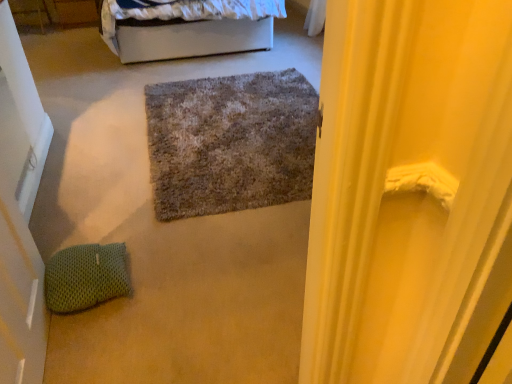
Question: Considering the relative sizes of wooden drawer at upper left and white matte door at left in the image provided, is wooden drawer at upper left shorter than white matte door at left?

Choices:
 (A) yes
 (B) no

Answer: (A)

Question: Would you say white matte door at left is part of wooden drawer at upper left's contents?

Choices:
 (A) yes
 (B) no

Answer: (B)

Question: Could you tell me if wooden drawer at upper left is facing white matte door at left?

Choices:
 (A) yes
 (B) no

Answer: (A)

Question: Considering the relative positions of wooden drawer at upper left and white matte door at left in the image provided, is wooden drawer at upper left to the right of white matte door at left from the viewer's perspective?

Choices:
 (A) no
 (B) yes

Answer: (A)

Question: From the image's perspective, is wooden drawer at upper left located beneath white matte door at left?

Choices:
 (A) no
 (B) yes

Answer: (A)

Question: Is point (163, 99) closer or farther from the camera than point (77, 306)?

Choices:
 (A) farther
 (B) closer

Answer: (A)

Question: From a real-world perspective, is textured gray rug at center above or below green knitted pillow at lower left?

Choices:
 (A) above
 (B) below

Answer: (B)

Question: Is textured gray rug at center in front of or behind green knitted pillow at lower left in the image?

Choices:
 (A) behind
 (B) front

Answer: (A)

Question: Considering the positions of textured gray rug at center and green knitted pillow at lower left in the image, is textured gray rug at center wider or thinner than green knitted pillow at lower left?

Choices:
 (A) wide
 (B) thin

Answer: (A)

Question: Based on their sizes in the image, would you say wooden drawer at upper left is bigger or smaller than textured gray rug at center?

Choices:
 (A) big
 (B) small

Answer: (B)

Question: Which is correct: wooden drawer at upper left is inside textured gray rug at center, or outside of it?

Choices:
 (A) outside
 (B) inside

Answer: (A)

Question: From their relative heights in the image, would you say wooden drawer at upper left is taller or shorter than textured gray rug at center?

Choices:
 (A) short
 (B) tall

Answer: (B)

Question: Is wooden drawer at upper left wider or thinner than textured gray rug at center?

Choices:
 (A) thin
 (B) wide

Answer: (A)

Question: Which is correct: white fabric bed at upper center is inside wooden drawer at upper left, or outside of it?

Choices:
 (A) inside
 (B) outside

Answer: (B)

Question: Considering the positions of point (224, 36) and point (73, 1), is point (224, 36) closer or farther from the camera than point (73, 1)?

Choices:
 (A) farther
 (B) closer

Answer: (B)